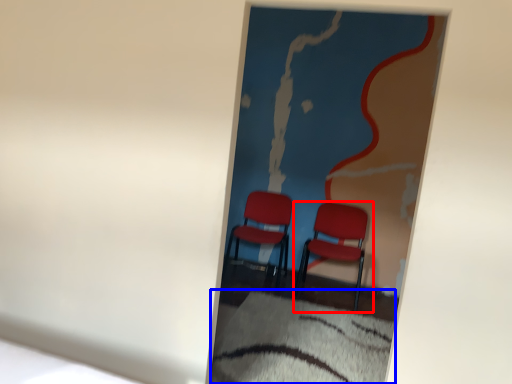
Question: Which point is closer to the camera, chair (highlighted by a red box) or sheet (highlighted by a blue box)?

Choices:
 (A) chair
 (B) sheet

Answer: (B)